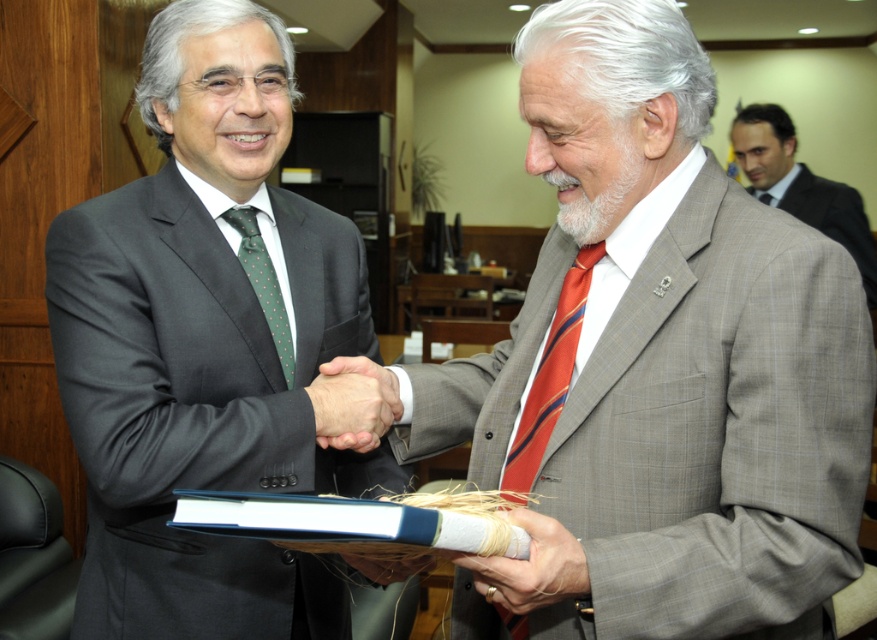
Question: Which is farther from the red silk tie at center?

Choices:
 (A) smooth skin handshake at center
 (B) green dotted tie at left
 (C) matte black suit at center
 (D) red striped tie at center

Answer: (D)

Question: Which point is closer to the camera?

Choices:
 (A) (638, 397)
 (B) (376, 365)
 (C) (551, 596)

Answer: (C)

Question: Does gray textured suit at center have a greater width compared to green dotted tie at left?

Choices:
 (A) yes
 (B) no

Answer: (A)

Question: Among these objects, which one is farthest from the camera?

Choices:
 (A) smooth beige glove at center
 (B) green dotted tie at left
 (C) gray textured suit at upper right
 (D) red striped tie at center

Answer: (D)

Question: Does gray textured suit at center have a larger size compared to red striped tie at center?

Choices:
 (A) no
 (B) yes

Answer: (B)

Question: Is gray textured suit at center to the left of matte black suit at center from the viewer's perspective?

Choices:
 (A) no
 (B) yes

Answer: (A)